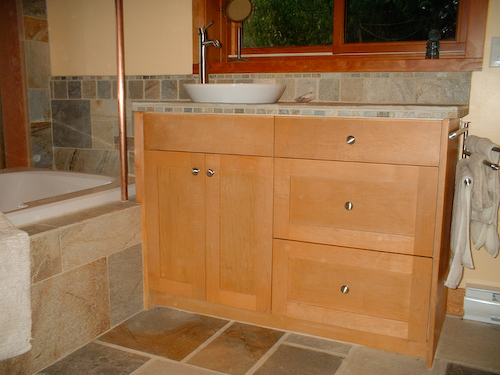
Locate an element on the screen. white towel is located at coordinates (16, 290).